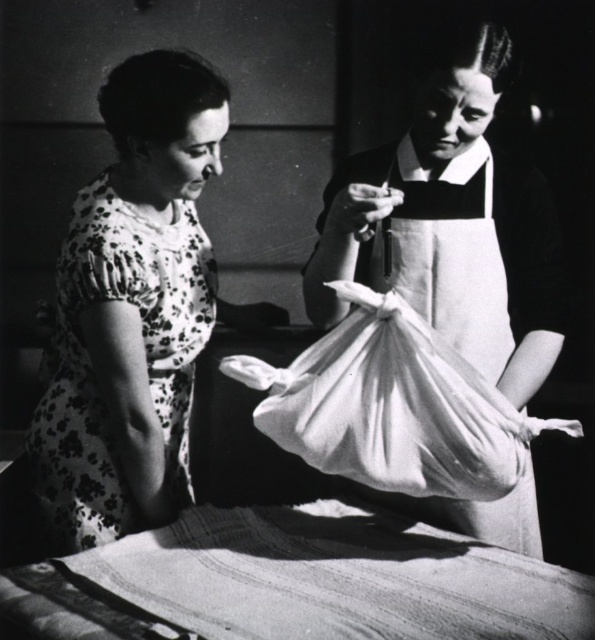
Is textured fabric bed at lower center closer to camera compared to white fabric bag at center?

Yes, textured fabric bed at lower center is closer to the viewer.

Is textured fabric bed at lower center smaller than white fabric bag at center?

Correct, textured fabric bed at lower center occupies less space than white fabric bag at center.

Does point (355, 541) come closer to viewer compared to point (311, 280)?

Yes.

Where is `textured fabric bed at lower center`? The width and height of the screenshot is (595, 640). textured fabric bed at lower center is located at coordinates (298, 582).

Is white fabric bag at center positioned before floral print dress at left?

Yes.

Does white fabric bag at center appear on the left side of floral print dress at left?

In fact, white fabric bag at center is to the right of floral print dress at left.

Find the location of `white fabric bag at center`. white fabric bag at center is located at coordinates (452, 224).

Based on the photo, is textured fabric bed at lower center bigger than floral print dress at left?

No.

Who is higher up, textured fabric bed at lower center or floral print dress at left?

Positioned higher is floral print dress at left.

Does point (500, 625) come in front of point (77, 541)?

Yes, point (500, 625) is in front of point (77, 541).

Locate an element on the screen. textured fabric bed at lower center is located at coordinates (298, 582).